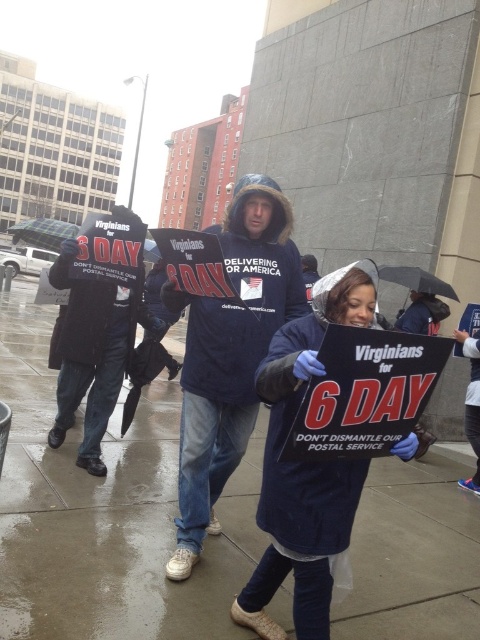
Which is more to the left, navy blue coat at center or green plaid fabric umbrella at upper left?

Positioned to the left is green plaid fabric umbrella at upper left.

Does navy blue coat at center have a greater height compared to green plaid fabric umbrella at upper left?

No, navy blue coat at center is not taller than green plaid fabric umbrella at upper left.

Is point (291, 372) closer to camera compared to point (48, 227)?

Yes, it is.

Where is `navy blue coat at center`? Image resolution: width=480 pixels, height=640 pixels. navy blue coat at center is located at coordinates (305, 468).

Does black matte jacket at left have a greater width compared to transparent plastic umbrella at center?

Indeed, black matte jacket at left has a greater width compared to transparent plastic umbrella at center.

Can you confirm if black matte jacket at left is positioned below transparent plastic umbrella at center?

Yes.

Which is behind, point (66, 365) or point (396, 273)?

Positioned behind is point (396, 273).

You are a GUI agent. You are given a task and a screenshot of the screen. Output one action in this format:
    pyautogui.click(x=<x>, y=<y>)
    Task: Click on the black matte jacket at left
    
    Given the screenshot: What is the action you would take?
    [x=94, y=349]

Can you confirm if dark blue fleece jacket at center is positioned below green plaid fabric umbrella at upper left?

Indeed, dark blue fleece jacket at center is positioned under green plaid fabric umbrella at upper left.

Which is behind, point (290, 314) or point (29, 227)?

Positioned behind is point (29, 227).

Describe the element at coordinates (229, 353) in the screenshot. The image size is (480, 640). I see `dark blue fleece jacket at center` at that location.

Where is `dark blue fleece jacket at center`? The height and width of the screenshot is (640, 480). dark blue fleece jacket at center is located at coordinates (229, 353).